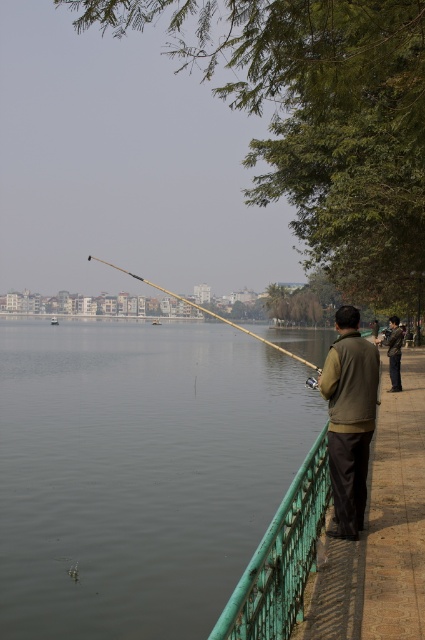
Question: Can you confirm if green painted metal railing at lower center is wider than wooden fishing pole at center?

Choices:
 (A) no
 (B) yes

Answer: (A)

Question: Which point is farther from the camera taking this photo?

Choices:
 (A) (184, 298)
 (B) (254, 605)
 (C) (198, 556)
 (D) (345, 346)

Answer: (A)

Question: From the image, what is the correct spatial relationship of green painted metal railing at lower center in relation to wooden fishing pole at center?

Choices:
 (A) right
 (B) left

Answer: (A)

Question: Based on their relative distances, which object is farther from the wooden fishing pole at center?

Choices:
 (A) brown suede jacket at center
 (B) green painted metal railing at lower center
 (C) clear water at railing right

Answer: (B)

Question: Which point is farther from the camera taking this photo?

Choices:
 (A) (354, 513)
 (B) (61, 400)
 (C) (260, 336)
 (D) (277, 573)

Answer: (C)

Question: Can you confirm if green painted metal railing at lower center is smaller than wooden fishing pole at center?

Choices:
 (A) no
 (B) yes

Answer: (B)